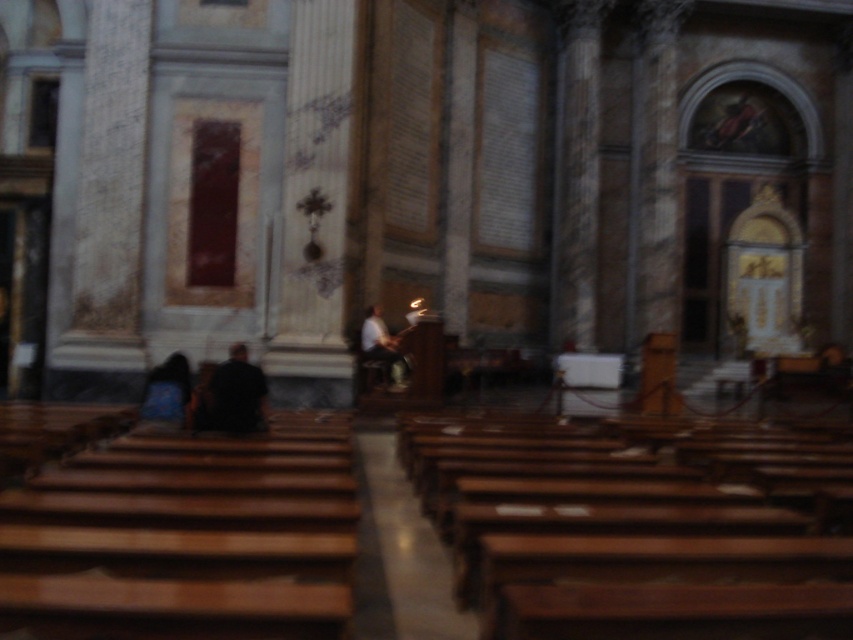
You are standing at the entrance of the grand church and notice two people wearing shirts at the center of the scene. Which shirt is closer to the ceiling? Please choose between the black matte shirt at center and the white matte shirt at center.

The white matte shirt at center is closer to the ceiling because the black matte shirt at center is positioned under it.

You are standing at the entrance of the grand church and notice a blue fabric bag at lower left. Where exactly is the blue fabric bag located in the church?

The blue fabric bag at lower left is located at point (167, 390) in the church.

You are standing at the entrance of the grand church and see the point marked at coordinates (167, 390). What object is located at that point?

The point marked at coordinates (167, 390) corresponds to the blue fabric bag at lower left.